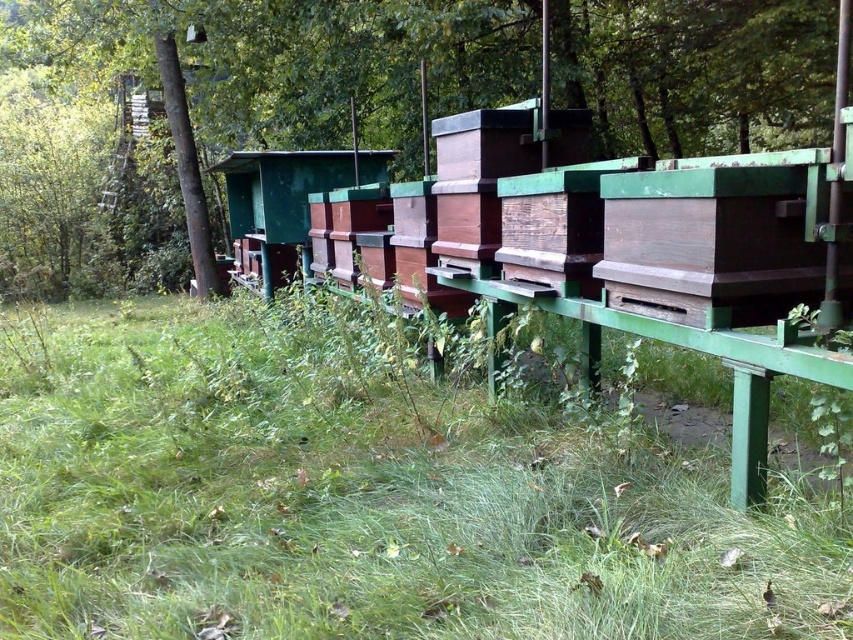
Can you confirm if green grass at lower center is taller than green wood tree at center?

No.

Between point (550, 529) and point (498, 67), which one is positioned behind?

Positioned behind is point (498, 67).

Image resolution: width=853 pixels, height=640 pixels. In order to click on green grass at lower center in this screenshot , I will do `click(358, 497)`.